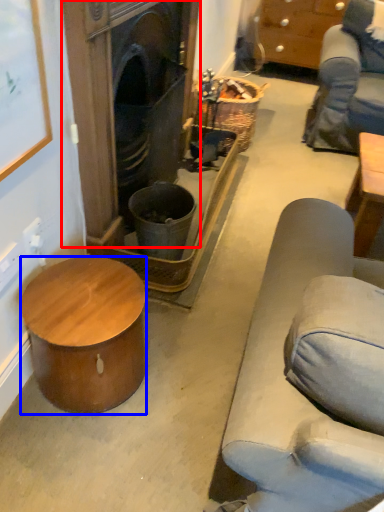
Question: Which point is closer to the camera, fireplace (highlighted by a red box) or desk (highlighted by a blue box)?

Choices:
 (A) fireplace
 (B) desk

Answer: (B)